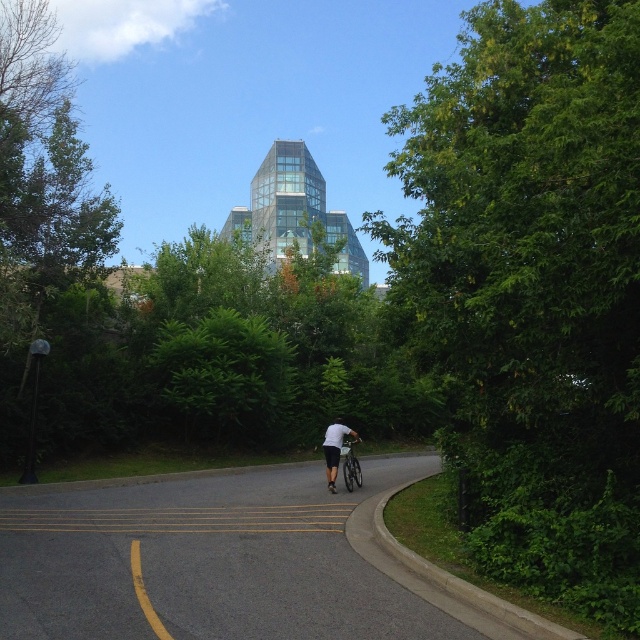
You are a cyclist planning to ride along the black asphalt bike lane at center. There is a green leafy tree at center nearby. Do you think the bike lane is wide enough for you to ride without hitting the tree?

The green leafy tree at center is wider than the black asphalt bike lane at center, so the bike lane may not be wide enough for safe riding without risking contact with the tree.

You are standing at the starting point of the pathway and want to reach the modern glass building in the background. You notice two points marked on the path. One is at coordinates point (620,285) and the other is at point (332,440). Which point should you walk towards first to get closer to the building?

You should walk towards point (332,440) first because point (620,285) is closer to the camera, meaning it is farther away from the modern glass building in the background. The point (332,440) is further away from the camera and thus closer to the building.

You are standing on the white matte shirt at center and want to reach the black asphalt bike lane at center. Which direction should you move to get there?

The black asphalt bike lane at center is to the left of the white matte shirt at center, so you should move to your left to reach it.